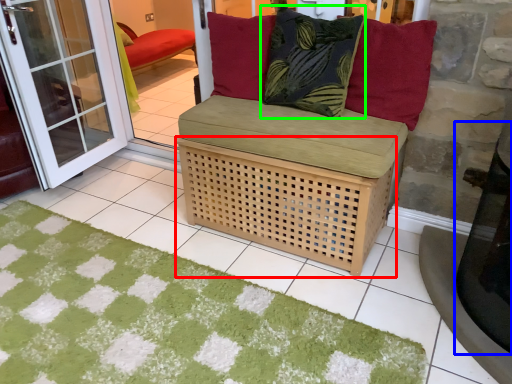
Question: Which object is positioned farthest from basket (highlighted by a red box)? Select from table (highlighted by a blue box) and pillow (highlighted by a green box).

Choices:
 (A) table
 (B) pillow

Answer: (A)